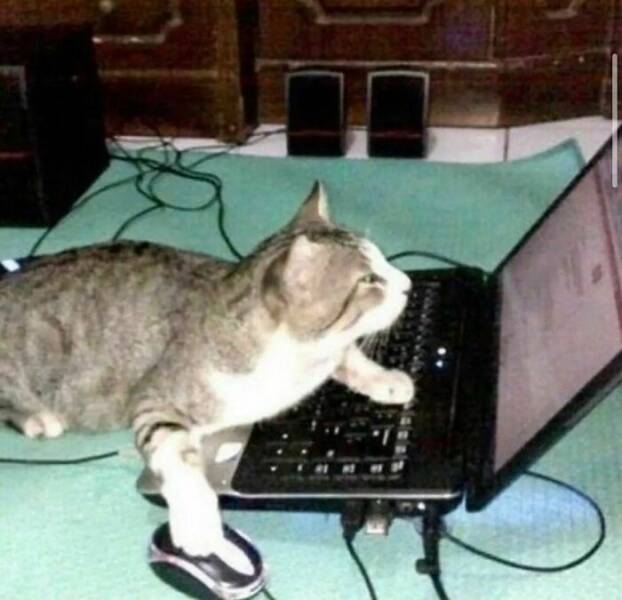
The width and height of the screenshot is (622, 600). I want to click on wall, so click(x=262, y=41).